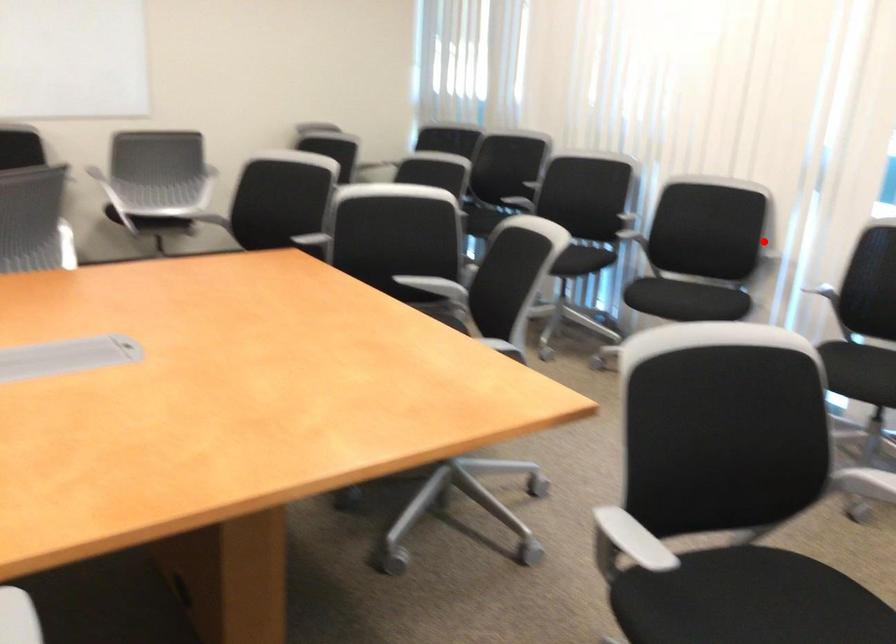
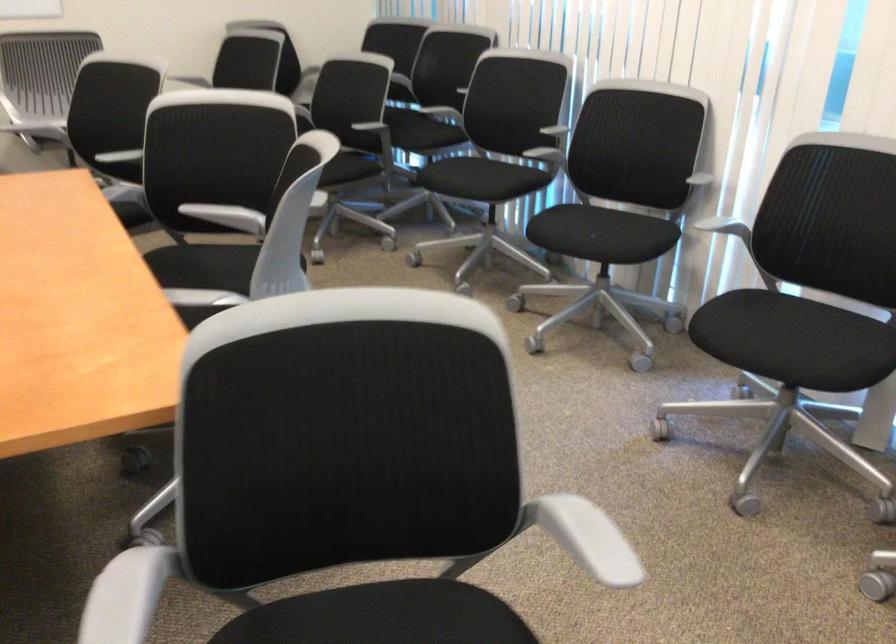
Find the pixel in the second image that matches the highlighted location in the first image.

(693, 174)